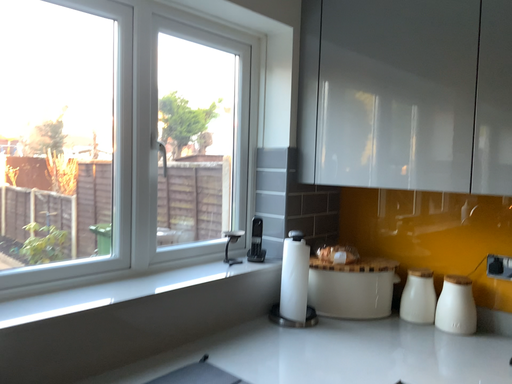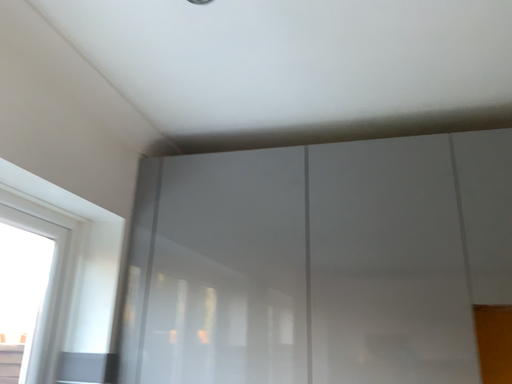
Question: Which way did the camera rotate in the video?

Choices:
 (A) rotated right
 (B) rotated left

Answer: (A)